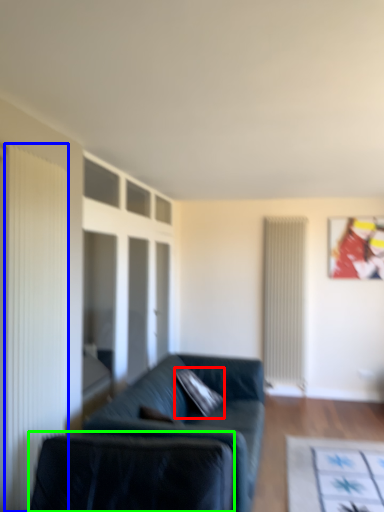
Question: Considering the real-world distances, which object is closest to pillow (highlighted by a red box)? curtain (highlighted by a blue box) or swivel chair (highlighted by a green box).

Choices:
 (A) curtain
 (B) swivel chair

Answer: (B)